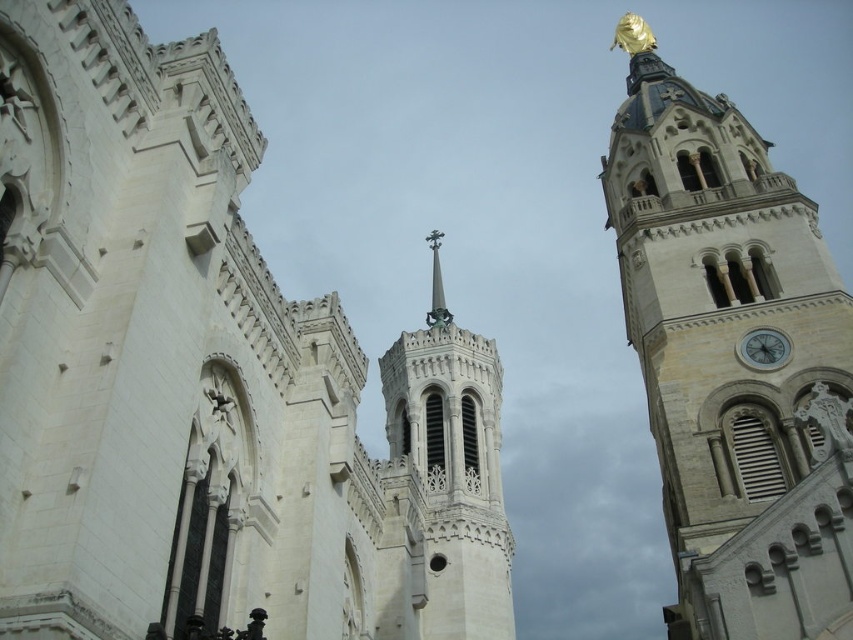
The height and width of the screenshot is (640, 853). I want to click on golden statue at upper right, so click(732, 360).

Does point (827, 308) come in front of point (454, 426)?

Yes, it is in front of point (454, 426).

Is point (825, 636) positioned after point (422, 378)?

That is False.

Where is `golden statue at upper right`? This screenshot has height=640, width=853. golden statue at upper right is located at coordinates (732, 360).

Between point (712, 419) and point (752, 346), which one is positioned in front?

Positioned in front is point (712, 419).

Between golden statue at upper right and white stone clock at right, which one appears on the right side from the viewer's perspective?

From the viewer's perspective, golden statue at upper right appears more on the right side.

What do you see at coordinates (732, 360) in the screenshot?
I see `golden statue at upper right` at bounding box center [732, 360].

The image size is (853, 640). I want to click on golden statue at upper right, so click(x=732, y=360).

Can you confirm if white stone church at center is positioned to the left of golden statue at upper right?

Indeed, white stone church at center is positioned on the left side of golden statue at upper right.

Does white stone church at center have a smaller size compared to golden statue at upper right?

Correct, white stone church at center occupies less space than golden statue at upper right.

What do you see at coordinates (207, 378) in the screenshot? I see `white stone church at center` at bounding box center [207, 378].

Image resolution: width=853 pixels, height=640 pixels. I want to click on white stone church at center, so click(x=207, y=378).